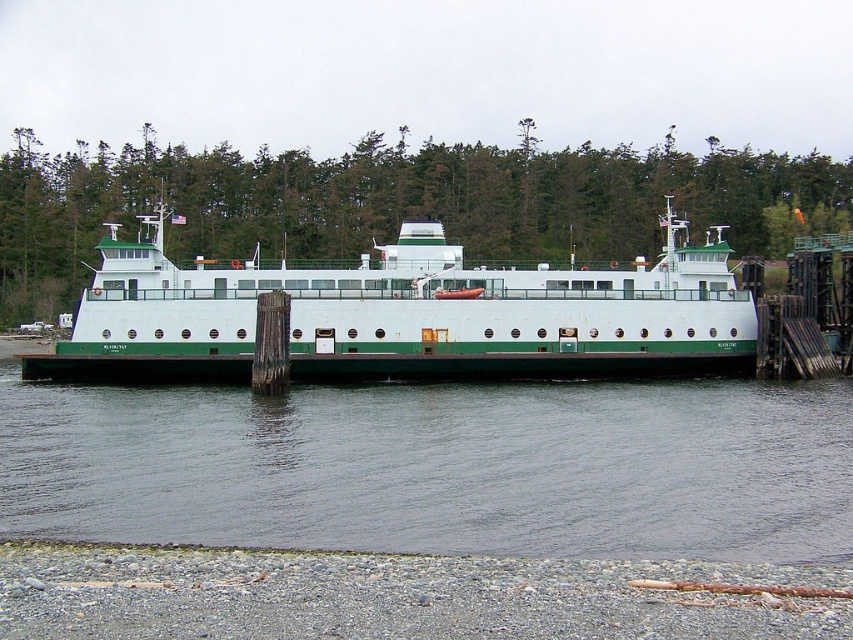
Question: Is the position of white matte ferry at center more distant than that of gray gravel shoreline at lower left?

Choices:
 (A) no
 (B) yes

Answer: (B)

Question: Which point is farther to the camera?

Choices:
 (A) green water at center
 (B) white matte ferry at center
 (C) gray gravel shoreline at lower left

Answer: (B)

Question: Can you confirm if green water at center is bigger than gray gravel shoreline at lower left?

Choices:
 (A) yes
 (B) no

Answer: (A)

Question: Which object is the closest to the green water at center?

Choices:
 (A) white matte ferry at center
 (B) gray gravel shoreline at lower left

Answer: (A)

Question: Which point is closer to the camera?

Choices:
 (A) (53, 582)
 (B) (413, 252)
 (C) (61, 465)

Answer: (A)

Question: Does white matte ferry at center have a lesser width compared to gray gravel shoreline at lower left?

Choices:
 (A) yes
 (B) no

Answer: (B)